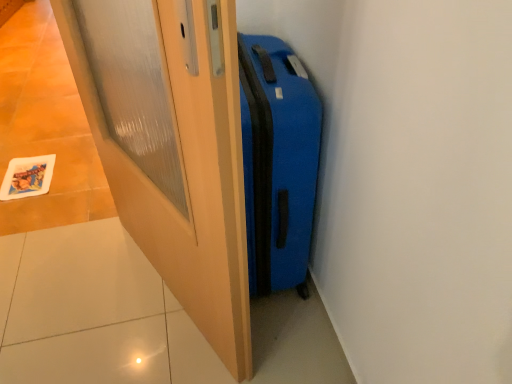
Find the location of a particular element. vacant area that lies in front of matte wood door at center is located at coordinates (144, 344).